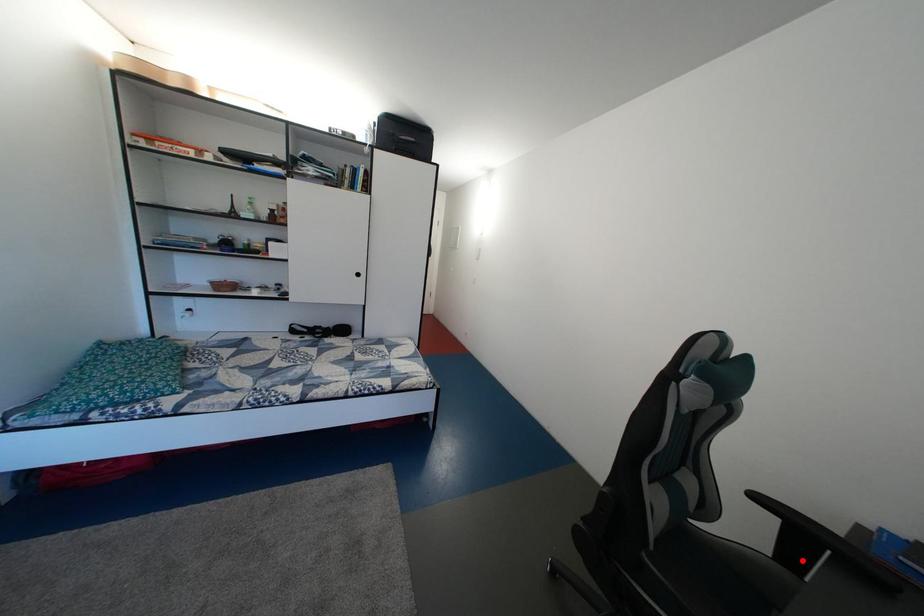
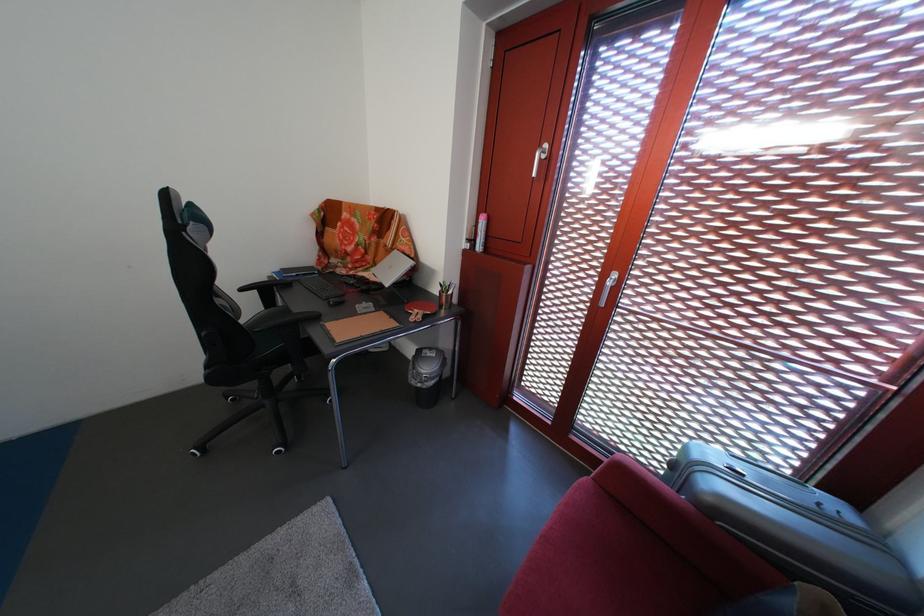
Find the pixel in the second image that matches the highlighted location in the first image.

(280, 308)